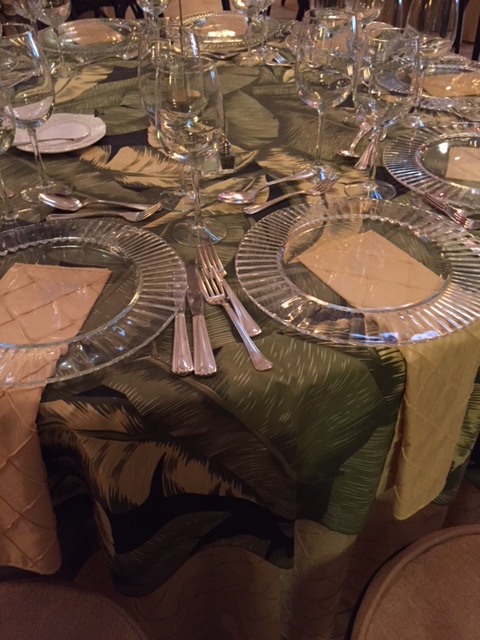
Find the location of a particular element. This screenshot has width=480, height=640. silver fork is located at coordinates (146, 214), (321, 189), (367, 152), (438, 204), (465, 220), (216, 260), (218, 294), (75, 137).